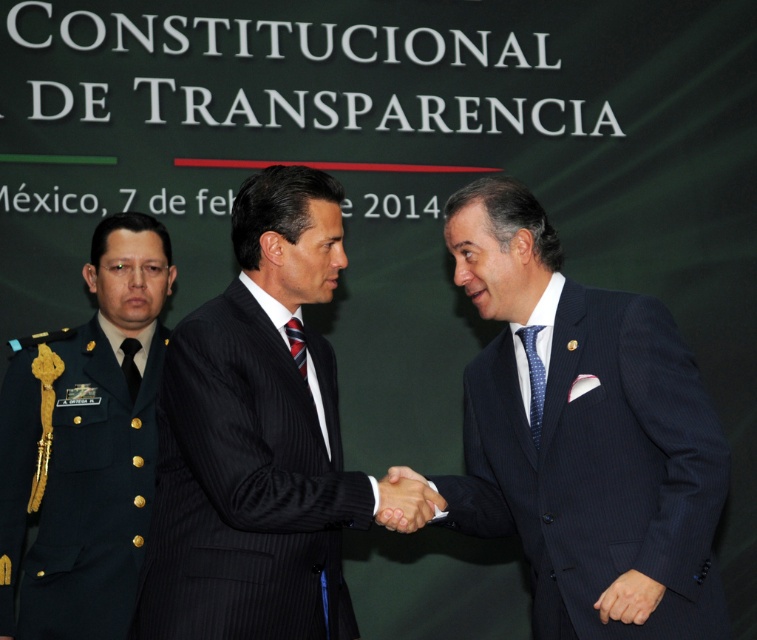
You are an event photographer at the formal event in front of the CONSTITUCIONAL DE TRANSPARENCIA backdrop. You need to capture a closeup shot of the black pinstripe suit at center and the striped fabric tie at center. Which one will appear larger in your photo?

The black pinstripe suit at center will appear larger in the photo because it is bigger than the striped fabric tie at center.

You are attending a formal event and notice two men shaking hands in front of a green backdrop. You see a black pinstripe suit at center and a striped fabric tie at center. Which object is positioned to the left of the other?

The black pinstripe suit at center is to the left of the striped fabric tie at center.

You are a photographer at the event. You want to capture a photo where the smooth skin handshake at center is positioned above the blue dotted fabric tie at center. Is this possible based on the current arrangement?

The smooth skin handshake at center is currently below the blue dotted fabric tie at center, so it is not possible to position the handshake above the tie without adjusting their positions.